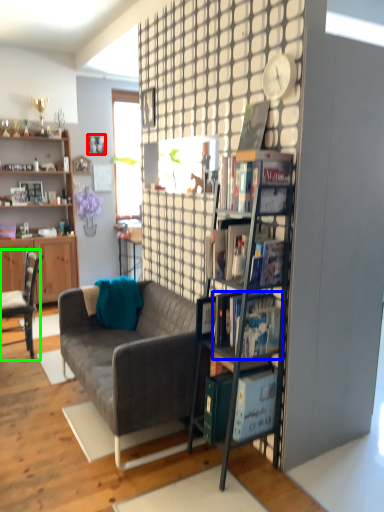
Question: Based on their relative distances, which object is farther from picture frame (highlighted by a red box)? Choose from book (highlighted by a blue box) and chair (highlighted by a green box).

Choices:
 (A) book
 (B) chair

Answer: (A)